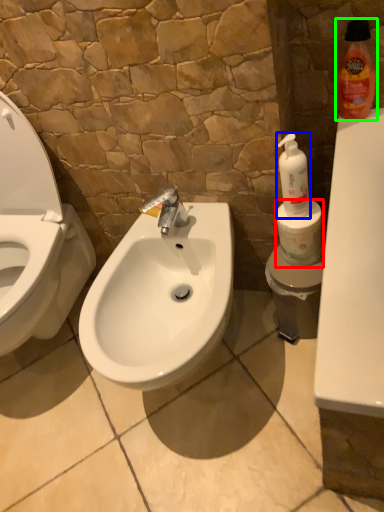
Question: Which object is positioned closest to toilet paper (highlighted by a red box)? Select from cleaning product (highlighted by a blue box) and cleaning product (highlighted by a green box).

Choices:
 (A) cleaning product
 (B) cleaning product

Answer: (A)